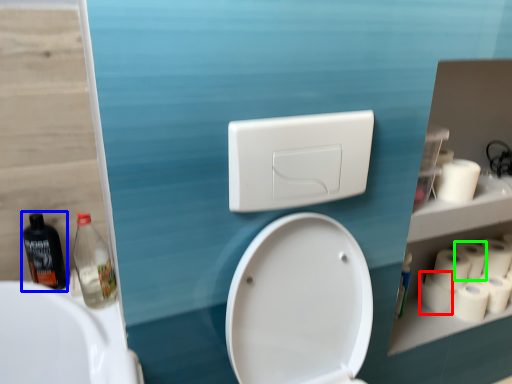
Question: Which object is positioned closest to toilet paper (highlighted by a red box)? Select from bottle (highlighted by a blue box) and toilet paper (highlighted by a green box).

Choices:
 (A) bottle
 (B) toilet paper

Answer: (B)